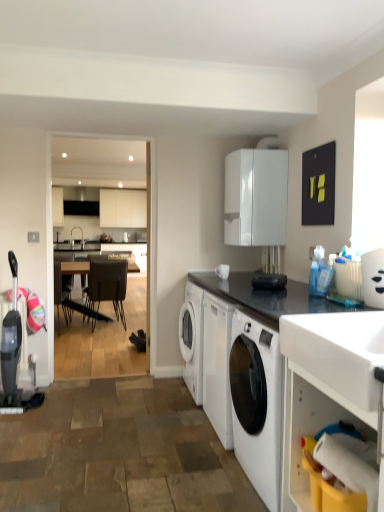
Question: From the image's perspective, is white glossy container at upper right above or below dark brown leather chair at center, which is the 2th chair in right-to-left order?

Choices:
 (A) below
 (B) above

Answer: (B)

Question: From a real-world perspective, is white glossy container at upper right physically located above or below dark brown leather chair at center, which is the 2th chair in right-to-left order?

Choices:
 (A) above
 (B) below

Answer: (A)

Question: Estimate the real-world distances between objects in this image. Which object is closer to the white glossy countertop at lower right, the 1th countertop in the bottom-to-top sequence?

Choices:
 (A) black granite countertop at center, acting as the 2th countertop starting from the bottom
 (B) leather-like dark brown chair at center, the second chair in the left-to-right sequence
 (C) white glossy cabinet at upper center
 (D) dark brown leather chair at center, which is the 2th chair in right-to-left order
 (E) white glossy sink at upper right

Answer: (E)

Question: Estimate the real-world distances between objects in this image. Which object is closer to the black granite countertop at center, arranged as the 1th countertop when viewed from the top?

Choices:
 (A) white glossy cabinet at upper center
 (B) dark brown leather chair at center, which is the 2th chair in right-to-left order
 (C) leather-like dark brown chair at center, the second chair in the left-to-right sequence
 (D) white glossy sink at upper right
 (E) white glossy countertop at lower right, the 2th countertop viewed from the top

Answer: (E)